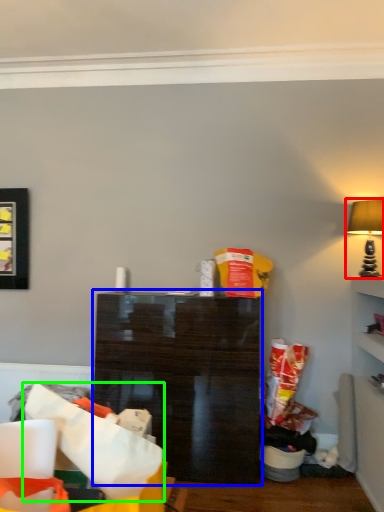
Question: Considering the real-world distances, which object is closest to lamp (highlighted by a red box)? shelf (highlighted by a blue box) or paper bag (highlighted by a green box).

Choices:
 (A) shelf
 (B) paper bag

Answer: (A)